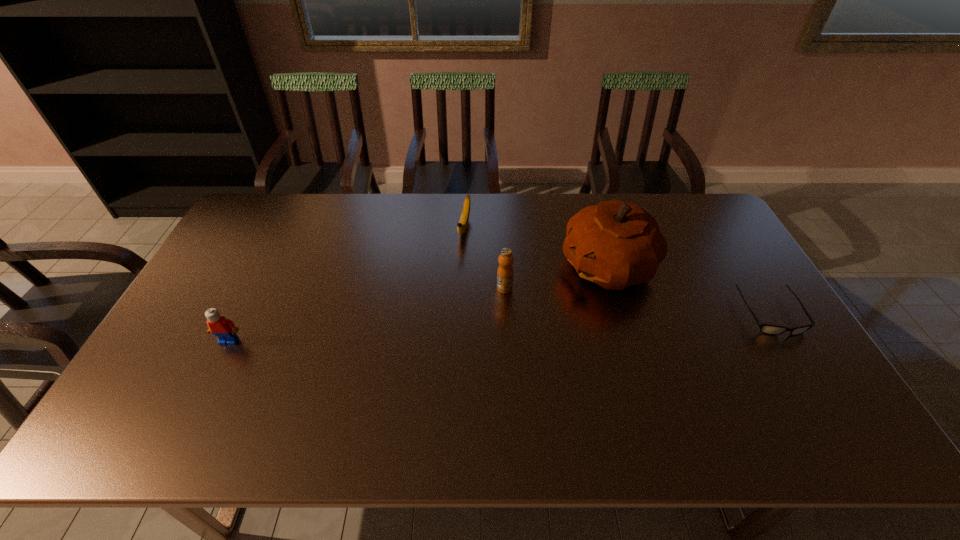
The width and height of the screenshot is (960, 540). In order to click on vacant position in the image that satisfies the following two spatial constraints: 1. on the back side of the third object from right to left; 2. on the right side of the fourth object from left to right in this screenshot , I will do (503, 267).